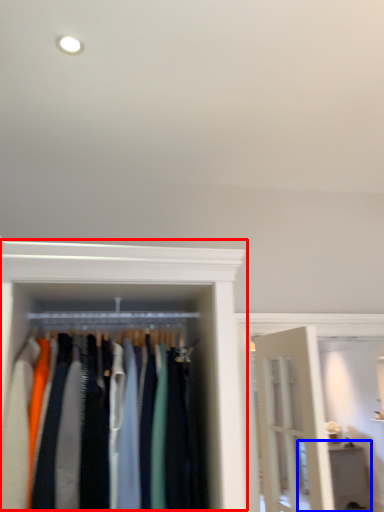
Question: Which of the following is the farthest to the observer, closet (highlighted by a red box) or furniture (highlighted by a blue box)?

Choices:
 (A) closet
 (B) furniture

Answer: (B)